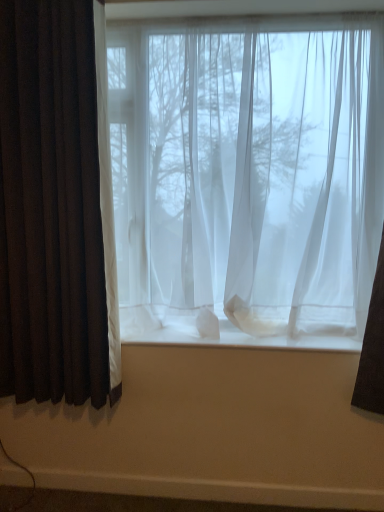
What do you see at coordinates (228, 329) in the screenshot?
I see `white sheer curtain at center` at bounding box center [228, 329].

Identify the location of dark brown velvet curtain at left. (51, 207).

Would you say dark brown velvet curtain at left is to the left or to the right of white sheer curtain at center in the picture?

From the image, it's evident that dark brown velvet curtain at left is to the left of white sheer curtain at center.

Which object is wider, dark brown velvet curtain at left or white sheer curtain at center?

With larger width is white sheer curtain at center.

Could you tell me if dark brown velvet curtain at left is facing white sheer curtain at center?

No, dark brown velvet curtain at left is not oriented towards white sheer curtain at center.

From the picture: Based on their sizes in the image, would you say dark brown velvet curtain at left is bigger or smaller than white sheer curtain at center?

Clearly, dark brown velvet curtain at left is larger in size than white sheer curtain at center.

Can you confirm if sheer white curtains at center is bigger than white sheer curtain at center?

Yes.

Would you consider sheer white curtains at center to be distant from white sheer curtain at center?

They are positioned close to each other.

Is sheer white curtains at center thinner than white sheer curtain at center?

No, sheer white curtains at center is not thinner than white sheer curtain at center.

Identify the location of window sill behind the sheer white curtains at center. This screenshot has height=512, width=384. (228, 329).

Which is more to the right, sheer white curtains at center or dark brown velvet curtain at left?

From the viewer's perspective, sheer white curtains at center appears more on the right side.

Is the position of sheer white curtains at center less distant than that of dark brown velvet curtain at left?

No, sheer white curtains at center is further to the viewer.

Which of these two, sheer white curtains at center or dark brown velvet curtain at left, is wider?

sheer white curtains at center is wider.

Is sheer white curtains at center positioned beyond the bounds of dark brown velvet curtain at left?

Yes.

Could you tell me if white sheer curtain at center is facing dark brown velvet curtain at left?

No, white sheer curtain at center does not turn towards dark brown velvet curtain at left.

Is white sheer curtain at center spatially inside dark brown velvet curtain at left, or outside of it?

white sheer curtain at center is located beyond the bounds of dark brown velvet curtain at left.

From the picture: Can you tell me how much white sheer curtain at center and dark brown velvet curtain at left differ in facing direction?

1.17 degrees separate the facing orientations of white sheer curtain at center and dark brown velvet curtain at left.

Can you confirm if dark brown velvet curtain at left is positioned to the right of sheer white curtains at center?

Incorrect, dark brown velvet curtain at left is not on the right side of sheer white curtains at center.

Choose the correct answer: Is dark brown velvet curtain at left inside sheer white curtains at center or outside it?

dark brown velvet curtain at left cannot be found inside sheer white curtains at center.

Does dark brown velvet curtain at left have a greater height compared to sheer white curtains at center?

Yes, dark brown velvet curtain at left is taller than sheer white curtains at center.

Is dark brown velvet curtain at left positioned with its back to sheer white curtains at center?

No, sheer white curtains at center is not at the back of dark brown velvet curtain at left.

Is white sheer curtain at center oriented away from sheer white curtains at center?

No, sheer white curtains at center is not at the back of white sheer curtain at center.

Identify the location of window on the left of the white sheer curtain at center. (247, 180).

Who is shorter, white sheer curtain at center or sheer white curtains at center?

white sheer curtain at center is shorter.

In the image, is white sheer curtain at center positioned in front of or behind sheer white curtains at center?

Clearly, white sheer curtain at center is behind sheer white curtains at center.

You are a GUI agent. You are given a task and a screenshot of the screen. Output one action in this format:
    pyautogui.click(x=<x>, y=<y>)
    Task: Click on the curtain above the white sheer curtain at center (from the image's perspective)
    The width and height of the screenshot is (384, 512).
    Given the screenshot: What is the action you would take?
    [51, 207]

In the image, there is a sheer white curtains at center. Where is `window sill below it (from the image's perspective)`? This screenshot has width=384, height=512. window sill below it (from the image's perspective) is located at coordinates (228, 329).

Based on the photo, from the image, which object appears to be farther from white sheer curtain at center, sheer white curtains at center or dark brown velvet curtain at left?

The object further to white sheer curtain at center is dark brown velvet curtain at left.

Considering their positions, is dark brown velvet curtain at left positioned closer to sheer white curtains at center than white sheer curtain at center?

Among the two, white sheer curtain at center is located nearer to sheer white curtains at center.

Which object lies further to the anchor point white sheer curtain at center, dark brown velvet curtain at left or sheer white curtains at center?

dark brown velvet curtain at left.

From the image, which object appears to be farther from sheer white curtains at center, white sheer curtain at center or dark brown velvet curtain at left?

The object further to sheer white curtains at center is dark brown velvet curtain at left.

Estimate the real-world distances between objects in this image. Which object is further from dark brown velvet curtain at left, white sheer curtain at center or sheer white curtains at center?

white sheer curtain at center lies further to dark brown velvet curtain at left than the other object.

When comparing their distances from dark brown velvet curtain at left, does sheer white curtains at center or white sheer curtain at center seem further?

white sheer curtain at center.

Image resolution: width=384 pixels, height=512 pixels. In order to click on window located between dark brown velvet curtain at left and white sheer curtain at center in the left-right direction in this screenshot , I will do `click(247, 180)`.